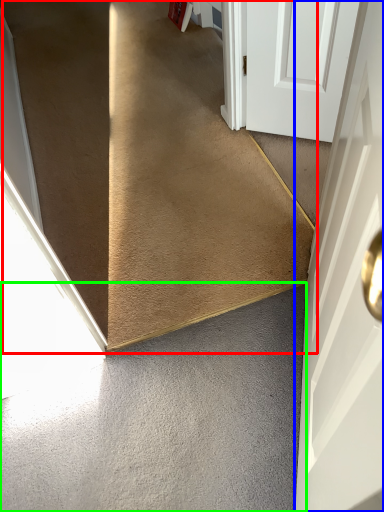
Question: Which is farther away from stairs (highlighted by a red box)? door (highlighted by a blue box) or concrete (highlighted by a green box)?

Choices:
 (A) door
 (B) concrete

Answer: (A)